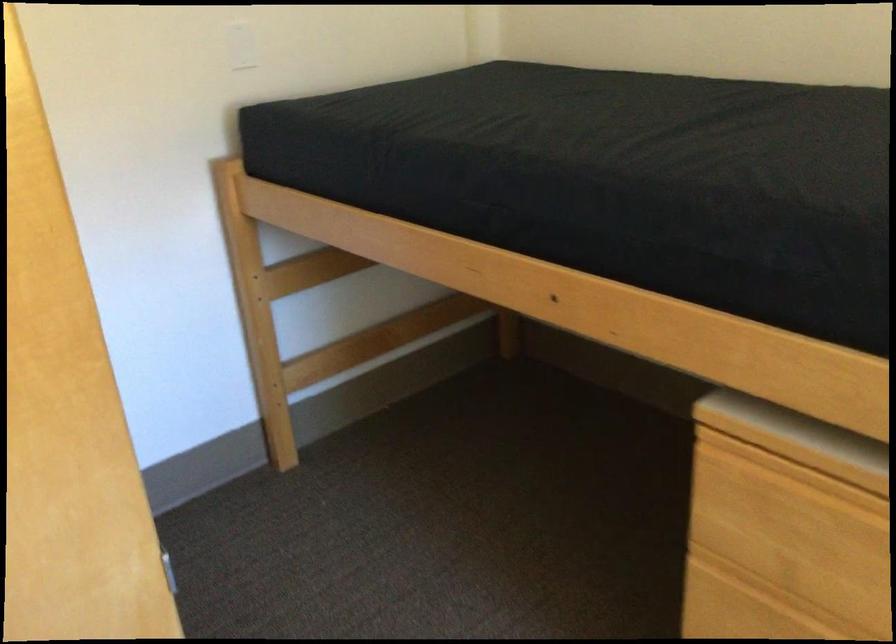
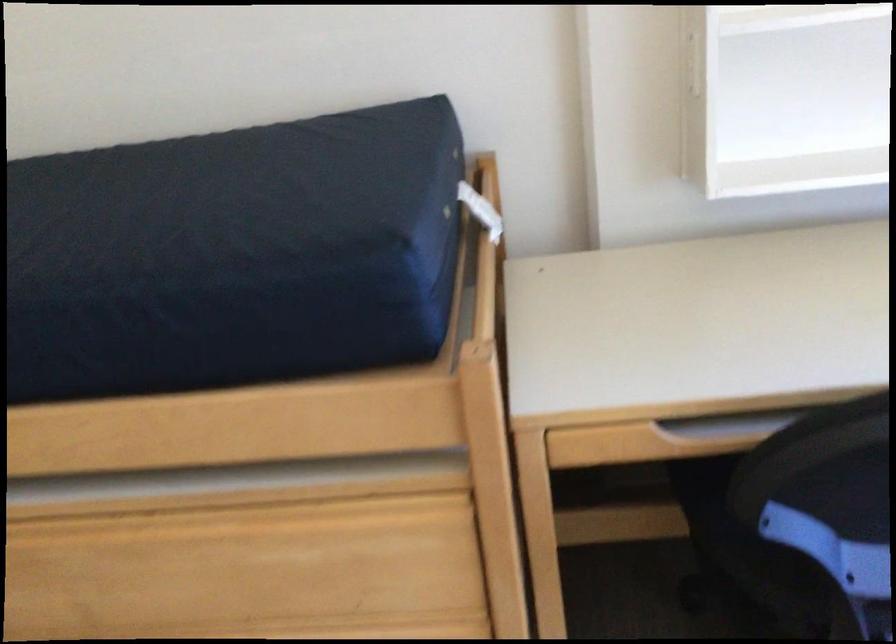
Question: The camera is either moving clockwise (left) or counter-clockwise (right) around the object. The first image is from the beginning of the video and the second image is from the end. Is the camera moving left or right when shooting the video?

Choices:
 (A) Left
 (B) Right

Answer: (A)